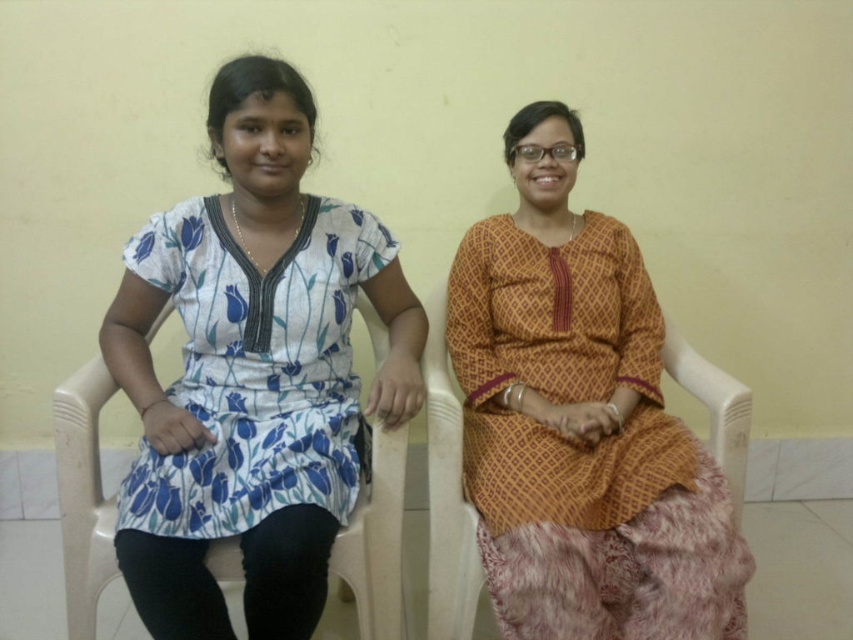
Question: Is white floral dress at left to the left of matte orange dress at center from the viewer's perspective?

Choices:
 (A) no
 (B) yes

Answer: (B)

Question: Is white floral dress at left in front of matte orange dress at center?

Choices:
 (A) no
 (B) yes

Answer: (B)

Question: Which point appears farthest from the camera in this image?

Choices:
 (A) (744, 540)
 (B) (230, 387)

Answer: (B)

Question: Which of the following is the closest to the observer?

Choices:
 (A) white floral dress at left
 (B) matte orange dress at center

Answer: (A)

Question: Observing the image, what is the correct spatial positioning of white floral dress at left in reference to matte orange dress at center?

Choices:
 (A) above
 (B) below

Answer: (A)

Question: Which point is farther to the camera?

Choices:
 (A) matte orange dress at center
 (B) white floral dress at left

Answer: (A)